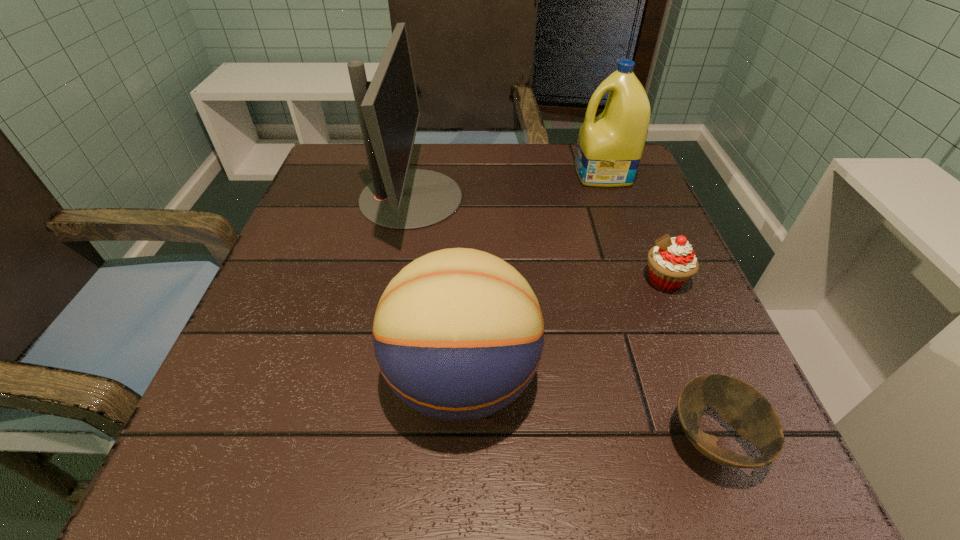
At what (x,y) coordinates should I click in order to perform the action: click on computer monitor. Please return your answer as a coordinate pair (x, y). Image resolution: width=960 pixels, height=540 pixels. Looking at the image, I should click on (399, 198).

This screenshot has height=540, width=960. Identify the location of detergent. (609, 148).

In order to click on basketball in this screenshot , I will do `click(458, 334)`.

Locate an element on the screen. Image resolution: width=960 pixels, height=540 pixels. the third nearest object is located at coordinates (672, 262).

Locate an element on the screen. cupcake is located at coordinates (672, 262).

The width and height of the screenshot is (960, 540). Find the location of `the shortest object`. the shortest object is located at coordinates (744, 408).

This screenshot has height=540, width=960. I want to click on vacant area located 0.210m on the screen of the tallest object, so click(558, 198).

Where is `vacant space located on the label of the detergent`? vacant space located on the label of the detergent is located at coordinates (482, 174).

The image size is (960, 540). What are the coordinates of `free space located on the label of the detergent` in the screenshot? It's located at (461, 174).

In order to click on free spot located on the label of the detergent in this screenshot , I will do click(418, 174).